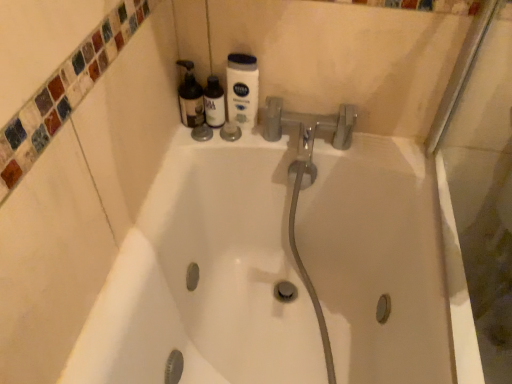
Image resolution: width=512 pixels, height=384 pixels. What do you see at coordinates (190, 97) in the screenshot?
I see `translucent plastic bottles at upper left, marked as the 2th cleaning product in a right-to-left arrangement` at bounding box center [190, 97].

Where is `translucent plastic bottle at upper center`? translucent plastic bottle at upper center is located at coordinates (214, 103).

Identify the location of translucent plastic bottles at upper left, the first cleaning product in the left-to-right sequence. pyautogui.click(x=190, y=97).

From the image's perspective, is translucent plastic bottles at upper left, marked as the 2th cleaning product in a right-to-left arrangement, located above white matte nivea lotion at upper center, marked as the 1th cleaning product in a right-to-left arrangement?

Yes, from the image's perspective, translucent plastic bottles at upper left, marked as the 2th cleaning product in a right-to-left arrangement, is above white matte nivea lotion at upper center, marked as the 1th cleaning product in a right-to-left arrangement.

Is point (192, 122) farther from viewer compared to point (232, 118)?

No, (192, 122) is in front of (232, 118).

Considering the sizes of objects translucent plastic bottles at upper left, the first cleaning product in the left-to-right sequence, and white matte nivea lotion at upper center, marked as the second cleaning product in a left-to-right arrangement, in the image provided, who is smaller, translucent plastic bottles at upper left, the first cleaning product in the left-to-right sequence, or white matte nivea lotion at upper center, marked as the second cleaning product in a left-to-right arrangement,?

white matte nivea lotion at upper center, marked as the second cleaning product in a left-to-right arrangement, is smaller.

Considering the relative sizes of translucent plastic bottles at upper left, the first cleaning product in the left-to-right sequence, and translucent plastic bottle at upper center in the image provided, is translucent plastic bottles at upper left, the first cleaning product in the left-to-right sequence, bigger than translucent plastic bottle at upper center?

Correct, translucent plastic bottles at upper left, the first cleaning product in the left-to-right sequence, is larger in size than translucent plastic bottle at upper center.

Between translucent plastic bottles at upper left, the first cleaning product in the left-to-right sequence, and translucent plastic bottle at upper center, which one has larger width?

translucent plastic bottles at upper left, the first cleaning product in the left-to-right sequence, is wider.

Is translucent plastic bottles at upper left, marked as the 2th cleaning product in a right-to-left arrangement, located outside translucent plastic bottle at upper center?

Yes, translucent plastic bottles at upper left, marked as the 2th cleaning product in a right-to-left arrangement, is outside of translucent plastic bottle at upper center.

From the image's perspective, is translucent plastic bottle at upper center above white matte nivea lotion at upper center, marked as the second cleaning product in a left-to-right arrangement?

Incorrect, from the image's perspective, translucent plastic bottle at upper center is lower than white matte nivea lotion at upper center, marked as the second cleaning product in a left-to-right arrangement.

Between translucent plastic bottle at upper center and white matte nivea lotion at upper center, marked as the second cleaning product in a left-to-right arrangement, which one has smaller size?

Smaller between the two is translucent plastic bottle at upper center.

Considering the positions of points (214, 100) and (247, 116), is point (214, 100) farther from camera compared to point (247, 116)?

No.

Are translucent plastic bottle at upper center and white matte nivea lotion at upper center, marked as the second cleaning product in a left-to-right arrangement, located far from each other?

Actually, translucent plastic bottle at upper center and white matte nivea lotion at upper center, marked as the second cleaning product in a left-to-right arrangement, are a little close together.

Between white matte nivea lotion at upper center, marked as the 1th cleaning product in a right-to-left arrangement, and translucent plastic bottle at upper center, which one has less height?

translucent plastic bottle at upper center.

Does point (233, 117) appear closer or farther from the camera than point (218, 109)?

Point (233, 117).

Could you tell me if white matte nivea lotion at upper center, marked as the 1th cleaning product in a right-to-left arrangement, is facing translucent plastic bottles at upper left, marked as the 2th cleaning product in a right-to-left arrangement?

No.

Is white matte nivea lotion at upper center, marked as the second cleaning product in a left-to-right arrangement, bigger than translucent plastic bottles at upper left, marked as the 2th cleaning product in a right-to-left arrangement?

No.

From a real-world perspective, is white matte nivea lotion at upper center, marked as the 1th cleaning product in a right-to-left arrangement, above or below translucent plastic bottles at upper left, the first cleaning product in the left-to-right sequence?

From a real-world perspective, white matte nivea lotion at upper center, marked as the 1th cleaning product in a right-to-left arrangement, is physically above translucent plastic bottles at upper left, the first cleaning product in the left-to-right sequence.

Considering the relative positions of white matte nivea lotion at upper center, marked as the 1th cleaning product in a right-to-left arrangement, and translucent plastic bottles at upper left, marked as the 2th cleaning product in a right-to-left arrangement, in the image provided, is white matte nivea lotion at upper center, marked as the 1th cleaning product in a right-to-left arrangement, to the left of translucent plastic bottles at upper left, marked as the 2th cleaning product in a right-to-left arrangement, from the viewer's perspective?

Incorrect, white matte nivea lotion at upper center, marked as the 1th cleaning product in a right-to-left arrangement, is not on the left side of translucent plastic bottles at upper left, marked as the 2th cleaning product in a right-to-left arrangement.

Is translucent plastic bottle at upper center far away from translucent plastic bottles at upper left, marked as the 2th cleaning product in a right-to-left arrangement?

No, there isn't a large distance between translucent plastic bottle at upper center and translucent plastic bottles at upper left, marked as the 2th cleaning product in a right-to-left arrangement.

Based on their positions, is translucent plastic bottle at upper center located to the left or right of translucent plastic bottles at upper left, the first cleaning product in the left-to-right sequence?

translucent plastic bottle at upper center is positioned on translucent plastic bottles at upper left, the first cleaning product in the left-to-right sequence,'s right side.

Can you confirm if translucent plastic bottle at upper center is taller than translucent plastic bottles at upper left, the first cleaning product in the left-to-right sequence?

No.

This screenshot has height=384, width=512. In order to click on cleaning product lying below the translucent plastic bottles at upper left, marked as the 2th cleaning product in a right-to-left arrangement (from the image's perspective) in this screenshot , I will do `click(242, 89)`.

Identify the location of cleaning product on the left side of translucent plastic bottle at upper center. (190, 97).

Which object lies further to the anchor point white matte nivea lotion at upper center, marked as the 1th cleaning product in a right-to-left arrangement, translucent plastic bottle at upper center or translucent plastic bottles at upper left, marked as the 2th cleaning product in a right-to-left arrangement?

translucent plastic bottles at upper left, marked as the 2th cleaning product in a right-to-left arrangement, lies further to white matte nivea lotion at upper center, marked as the 1th cleaning product in a right-to-left arrangement, than the other object.

Which object lies nearer to the anchor point translucent plastic bottles at upper left, the first cleaning product in the left-to-right sequence, translucent plastic bottle at upper center or white matte nivea lotion at upper center, marked as the 1th cleaning product in a right-to-left arrangement?

translucent plastic bottle at upper center.

When comparing their distances from white matte nivea lotion at upper center, marked as the 1th cleaning product in a right-to-left arrangement, does translucent plastic bottles at upper left, marked as the 2th cleaning product in a right-to-left arrangement, or translucent plastic bottle at upper center seem further?

translucent plastic bottles at upper left, marked as the 2th cleaning product in a right-to-left arrangement.

Looking at the image, which one is located closer to translucent plastic bottle at upper center, white matte nivea lotion at upper center, marked as the 1th cleaning product in a right-to-left arrangement, or translucent plastic bottles at upper left, marked as the 2th cleaning product in a right-to-left arrangement?

translucent plastic bottles at upper left, marked as the 2th cleaning product in a right-to-left arrangement, is positioned closer to the anchor translucent plastic bottle at upper center.

When comparing their distances from translucent plastic bottles at upper left, marked as the 2th cleaning product in a right-to-left arrangement, does white matte nivea lotion at upper center, marked as the 1th cleaning product in a right-to-left arrangement, or translucent plastic bottle at upper center seem further?

white matte nivea lotion at upper center, marked as the 1th cleaning product in a right-to-left arrangement, is positioned further to the anchor translucent plastic bottles at upper left, marked as the 2th cleaning product in a right-to-left arrangement.

When comparing their distances from translucent plastic bottle at upper center, does translucent plastic bottles at upper left, the first cleaning product in the left-to-right sequence, or white matte nivea lotion at upper center, marked as the 1th cleaning product in a right-to-left arrangement, seem further?

white matte nivea lotion at upper center, marked as the 1th cleaning product in a right-to-left arrangement, is positioned further to the anchor translucent plastic bottle at upper center.

At what (x,y) coordinates should I click in order to perform the action: click on bottle located between translucent plastic bottles at upper left, the first cleaning product in the left-to-right sequence, and white matte nivea lotion at upper center, marked as the second cleaning product in a left-to-right arrangement, in the left-right direction. Please return your answer as a coordinate pair (x, y). Looking at the image, I should click on (214, 103).